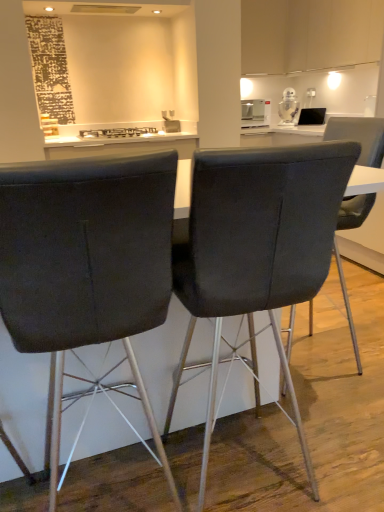
Question: Which direction should I rotate to look at matte black chair at center, arranged as the 3th chair when viewed from the right?

Choices:
 (A) right
 (B) left

Answer: (B)

Question: From the image's perspective, does satin silver toaster at upper center, acting as the second appliance starting from the right, appear lower than matte black chair at center, which is the second chair in right-to-left order?

Choices:
 (A) no
 (B) yes

Answer: (A)

Question: Is satin silver toaster at upper center, marked as the 1th appliance in a left-to-right arrangement, at the right side of matte black chair at center, the 2th chair in the left-to-right sequence?

Choices:
 (A) yes
 (B) no

Answer: (A)

Question: Does satin silver toaster at upper center, acting as the second appliance starting from the right, appear on the left side of matte black chair at center, which is the second chair in right-to-left order?

Choices:
 (A) no
 (B) yes

Answer: (A)

Question: Is matte black chair at center, the 2th chair in the left-to-right sequence, inside satin silver toaster at upper center, acting as the second appliance starting from the right?

Choices:
 (A) no
 (B) yes

Answer: (A)

Question: Is satin silver toaster at upper center, acting as the second appliance starting from the right, bigger than matte black chair at center, the 2th chair in the left-to-right sequence?

Choices:
 (A) no
 (B) yes

Answer: (A)

Question: Can you confirm if satin silver toaster at upper center, marked as the 1th appliance in a left-to-right arrangement, is thinner than matte black chair at center, which is the second chair in right-to-left order?

Choices:
 (A) no
 (B) yes

Answer: (B)

Question: From the image's perspective, is satin silver toaster at upper center, marked as the 1th appliance in a left-to-right arrangement, below black glass stove at center?

Choices:
 (A) no
 (B) yes

Answer: (A)

Question: Is satin silver toaster at upper center, marked as the 1th appliance in a left-to-right arrangement, to the right of black glass stove at center from the viewer's perspective?

Choices:
 (A) yes
 (B) no

Answer: (A)

Question: Is satin silver toaster at upper center, acting as the second appliance starting from the right, taller than black glass stove at center?

Choices:
 (A) yes
 (B) no

Answer: (A)

Question: From a real-world perspective, is satin silver toaster at upper center, marked as the 1th appliance in a left-to-right arrangement, positioned over black glass stove at center based on gravity?

Choices:
 (A) yes
 (B) no

Answer: (A)

Question: From the image's perspective, is satin silver toaster at upper center, marked as the 1th appliance in a left-to-right arrangement, on black glass stove at center?

Choices:
 (A) no
 (B) yes

Answer: (B)

Question: Is black glass stove at center at the back of satin silver toaster at upper center, marked as the 1th appliance in a left-to-right arrangement?

Choices:
 (A) yes
 (B) no

Answer: (B)

Question: Is velvet dark gray chair at center, placed as the third chair when sorted from left to right, at the left side of matte black chair at center, positioned as the 1th chair in left-to-right order?

Choices:
 (A) yes
 (B) no

Answer: (B)